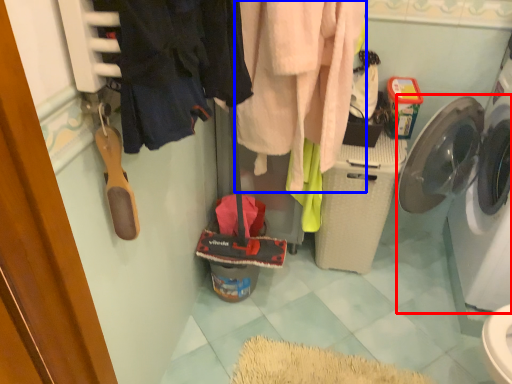
Question: Which point is further to the camera, washing machine (highlighted by a red box) or clothing (highlighted by a blue box)?

Choices:
 (A) washing machine
 (B) clothing

Answer: (A)